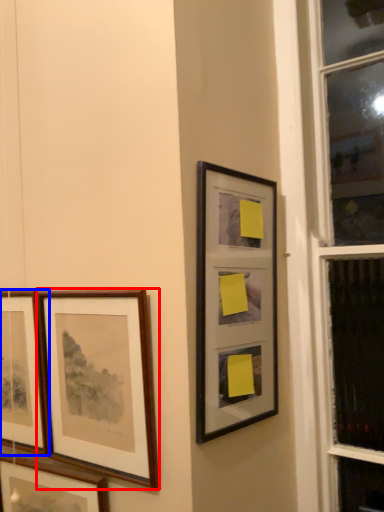
Question: Which of the following is the farthest to the observer, picture frame (highlighted by a red box) or picture frame (highlighted by a blue box)?

Choices:
 (A) picture frame
 (B) picture frame

Answer: (B)